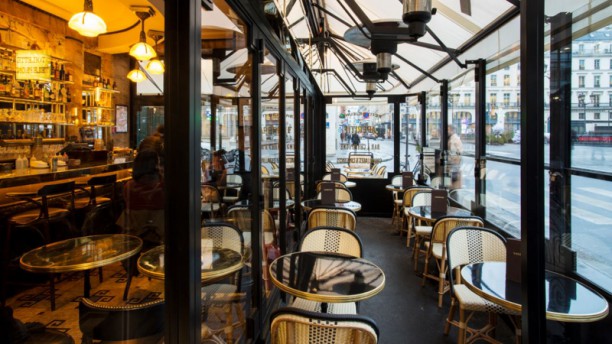
You are a GUI agent. You are given a task and a screenshot of the screen. Output one action in this format:
    pyautogui.click(x=<x>, y=<y>)
    Task: Click on the light fixtures
    
    Given the screenshot: What is the action you would take?
    pyautogui.click(x=92, y=24), pyautogui.click(x=138, y=50), pyautogui.click(x=153, y=62), pyautogui.click(x=136, y=72), pyautogui.click(x=418, y=20), pyautogui.click(x=381, y=43), pyautogui.click(x=371, y=88)